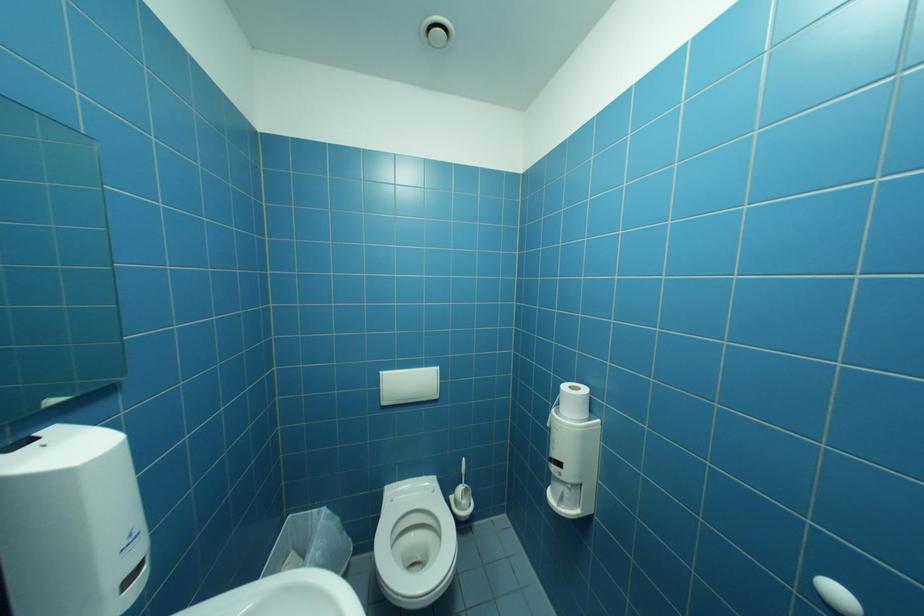
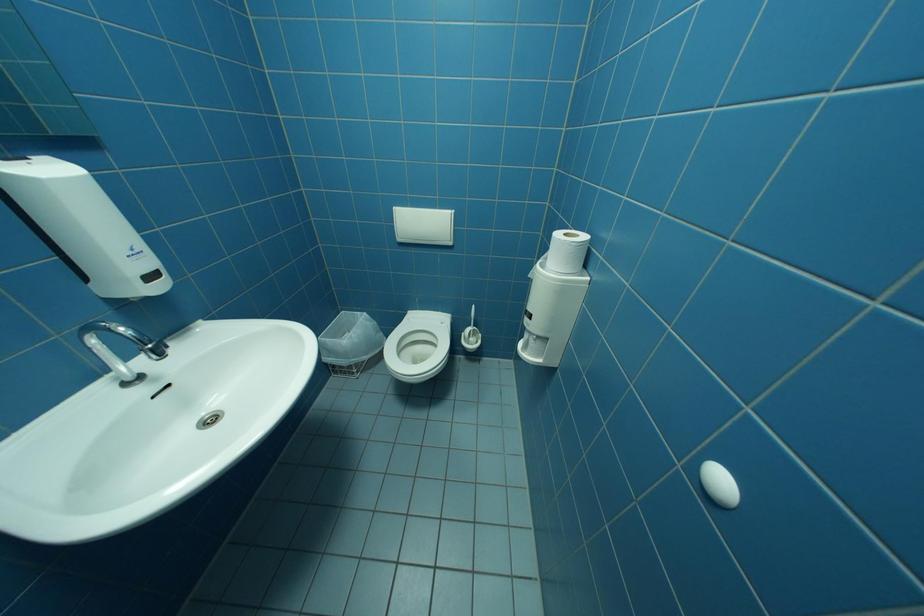
First-person continuous shooting, in which direction is the camera rotating?

The camera rotated toward left-down.